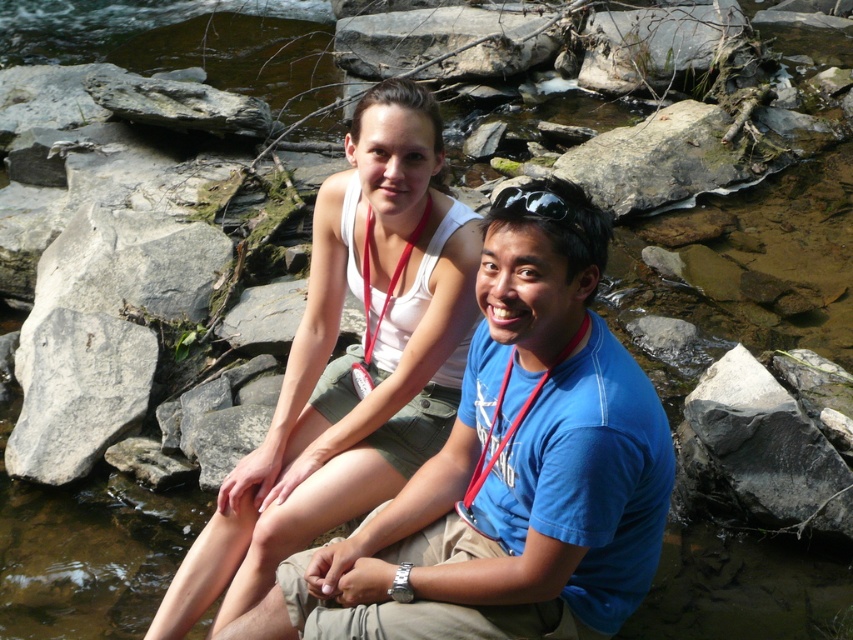
Can you confirm if white fabric tank top at center is taller than white smooth rock at left?

Yes, white fabric tank top at center is taller than white smooth rock at left.

Can you confirm if white fabric tank top at center is positioned to the left of white smooth rock at left?

No, white fabric tank top at center is not to the left of white smooth rock at left.

Identify the location of white fabric tank top at center. The width and height of the screenshot is (853, 640). (350, 360).

Can you confirm if blue cotton shirt at center is wider than white smooth rock at left?

Correct, the width of blue cotton shirt at center exceeds that of white smooth rock at left.

Can you confirm if blue cotton shirt at center is positioned above white smooth rock at left?

Correct, blue cotton shirt at center is located above white smooth rock at left.

Is point (456, 596) closer to camera compared to point (141, 365)?

Yes, it is in front of point (141, 365).

The width and height of the screenshot is (853, 640). I want to click on blue cotton shirt at center, so click(x=509, y=472).

Does white fabric tank top at center have a smaller size compared to black rubber goggles at upper center?

No.

Is point (352, 264) less distant than point (503, 195)?

No, (352, 264) is further to viewer.

This screenshot has width=853, height=640. I want to click on white fabric tank top at center, so click(x=350, y=360).